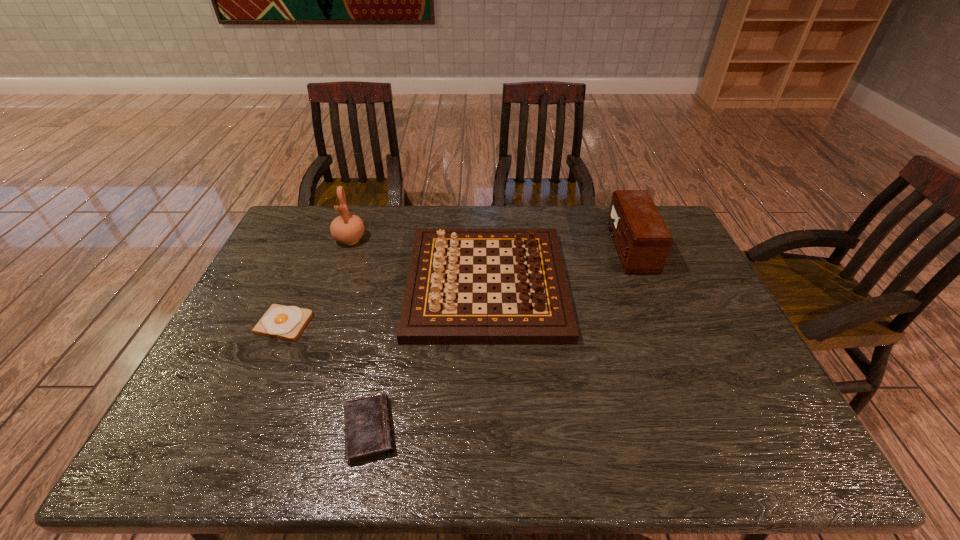
Locate an element on the screen. This screenshot has width=960, height=540. free space between the toast and the third shortest object is located at coordinates (385, 304).

This screenshot has height=540, width=960. Find the location of `object that is the second closest to the third shortest object`. object that is the second closest to the third shortest object is located at coordinates (347, 228).

Where is `object that stands as the closest to the third shortest object`? The image size is (960, 540). object that stands as the closest to the third shortest object is located at coordinates (367, 424).

Identify the location of free space that satisfies the following two spatial constraints: 1. on the spout of the pottery; 2. on the right side of the diary. (281, 430).